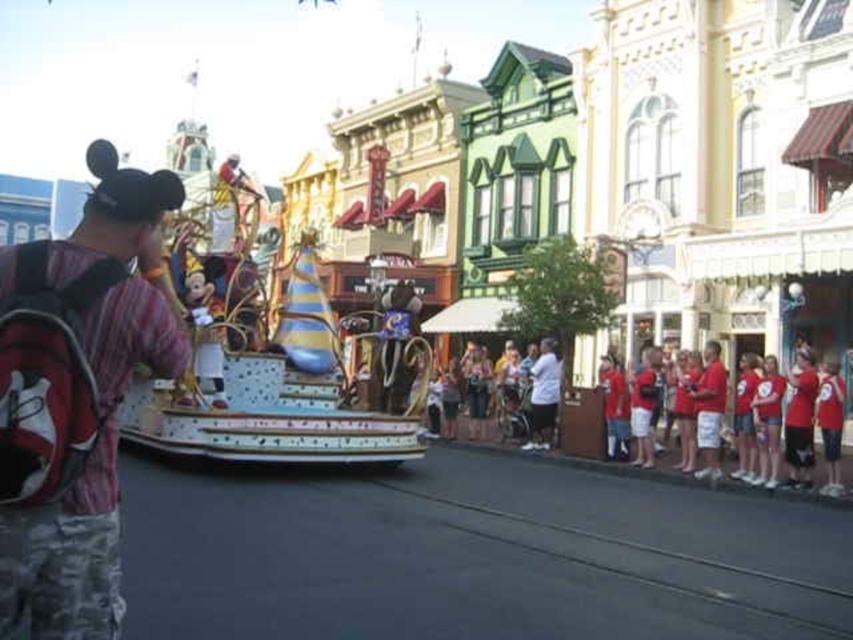
Question: Does striped cotton shirt at left appear over red cotton t-shirts at lower right?

Choices:
 (A) yes
 (B) no

Answer: (A)

Question: Which point is farther to the camera?

Choices:
 (A) (613, 474)
 (B) (129, 314)

Answer: (A)

Question: Does striped cotton shirt at left appear on the left side of red cotton t-shirts at lower right?

Choices:
 (A) no
 (B) yes

Answer: (B)

Question: Does striped cotton shirt at left appear under red cotton t-shirts at lower right?

Choices:
 (A) yes
 (B) no

Answer: (B)